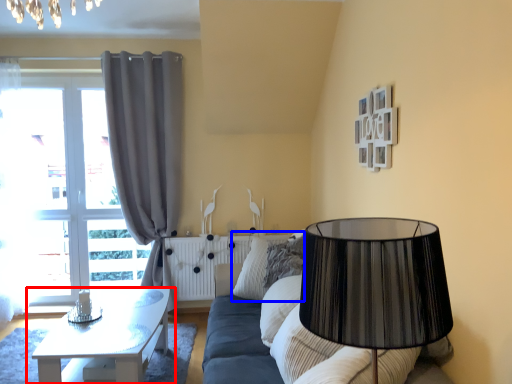
Question: Which object is closer to the camera taking this photo, table (highlighted by a red box) or pillow (highlighted by a blue box)?

Choices:
 (A) table
 (B) pillow

Answer: (A)